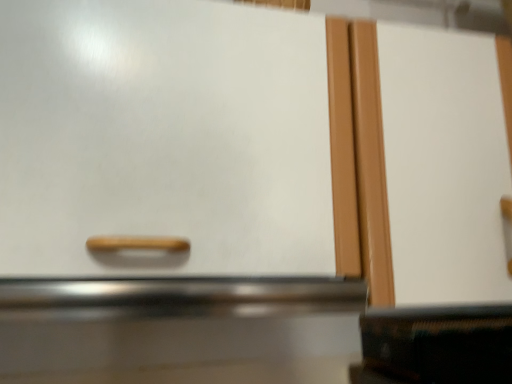
What do you see at coordinates (440, 343) in the screenshot? I see `black glossy cabinet at lower right` at bounding box center [440, 343].

Locate an element on the screen. black glossy cabinet at lower right is located at coordinates pos(440,343).

Locate an element on the screen. black glossy cabinet at lower right is located at coordinates tap(440, 343).